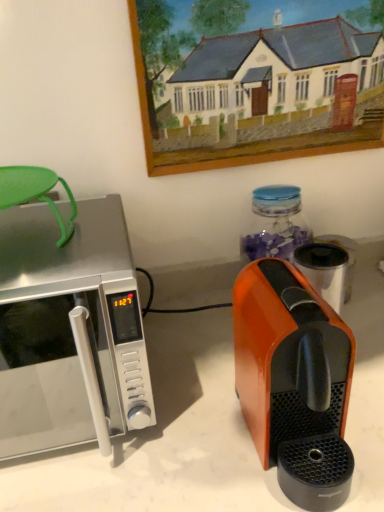
Question: Is orange glossy coffee maker at right taller than wooden picture frame at upper center?

Choices:
 (A) yes
 (B) no

Answer: (B)

Question: Is there a large distance between orange glossy coffee maker at right and wooden picture frame at upper center?

Choices:
 (A) no
 (B) yes

Answer: (A)

Question: Does orange glossy coffee maker at right appear on the left side of wooden picture frame at upper center?

Choices:
 (A) no
 (B) yes

Answer: (B)

Question: From a real-world perspective, is orange glossy coffee maker at right physically below wooden picture frame at upper center?

Choices:
 (A) yes
 (B) no

Answer: (A)

Question: Can you confirm if orange glossy coffee maker at right is bigger than wooden picture frame at upper center?

Choices:
 (A) no
 (B) yes

Answer: (B)

Question: Considering the relative sizes of orange glossy coffee maker at right and wooden picture frame at upper center in the image provided, is orange glossy coffee maker at right shorter than wooden picture frame at upper center?

Choices:
 (A) no
 (B) yes

Answer: (B)

Question: Is wooden picture frame at upper center not within orange glossy coffee maker at right?

Choices:
 (A) yes
 (B) no

Answer: (A)

Question: From the image's perspective, would you say wooden picture frame at upper center is shown under orange glossy coffee maker at right?

Choices:
 (A) no
 (B) yes

Answer: (A)

Question: Is wooden picture frame at upper center in front of orange glossy coffee maker at right?

Choices:
 (A) yes
 (B) no

Answer: (B)

Question: Considering the relative sizes of wooden picture frame at upper center and orange glossy coffee maker at right in the image provided, is wooden picture frame at upper center wider than orange glossy coffee maker at right?

Choices:
 (A) no
 (B) yes

Answer: (A)

Question: From a real-world perspective, is wooden picture frame at upper center under orange glossy coffee maker at right?

Choices:
 (A) no
 (B) yes

Answer: (A)

Question: Can you confirm if wooden picture frame at upper center is smaller than orange glossy coffee maker at right?

Choices:
 (A) yes
 (B) no

Answer: (A)

Question: Does orange glossy coffee maker at right touch satin silver microwave at left?

Choices:
 (A) yes
 (B) no

Answer: (B)